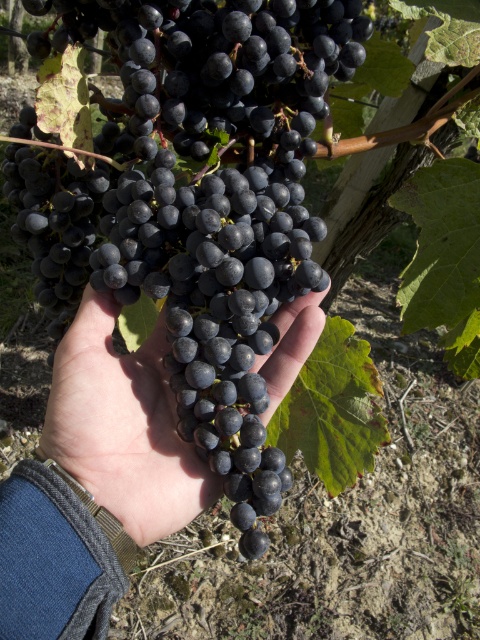
From the picture: You are a farmer checking the grapes in the vineyard. You notice the shiny dark purple grapes at center. Can you tell me the exact coordinates of their position?

The shiny dark purple grapes at center are located at coordinates point [193,195].

You are a photographer trying to capture the grapes in the image. You want to focus on the point closer to the viewer between the two points marked as point [266,272] and point [110,436]. Which point should you focus on?

You should focus on point [266,272] because it is closer to the viewer than point [110,436].

You are a fruit seller who wants to display two types of grapes in a basket. You have the shiny dark purple grapes at center and the matte black grapes at center. Which type of grapes takes up more space in the basket?

The shiny dark purple grapes at center take up more space in the basket because their width is larger than the matte black grapes at center.